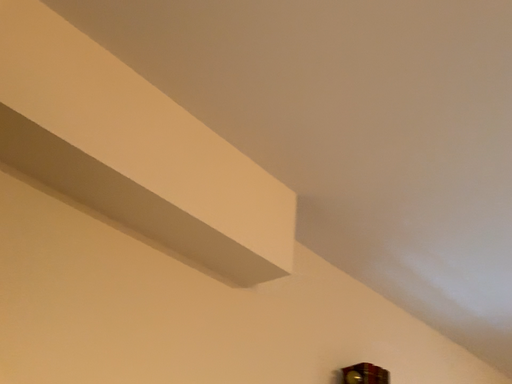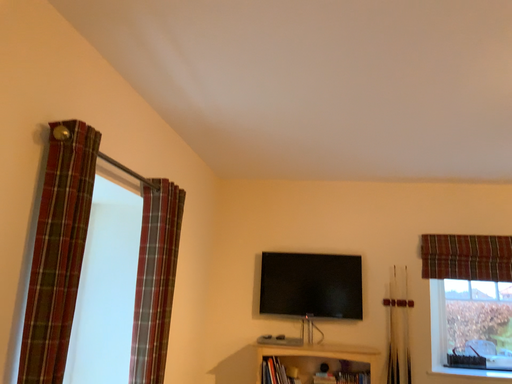
Question: How did the camera likely rotate when shooting the video?

Choices:
 (A) rotated right
 (B) rotated left

Answer: (A)